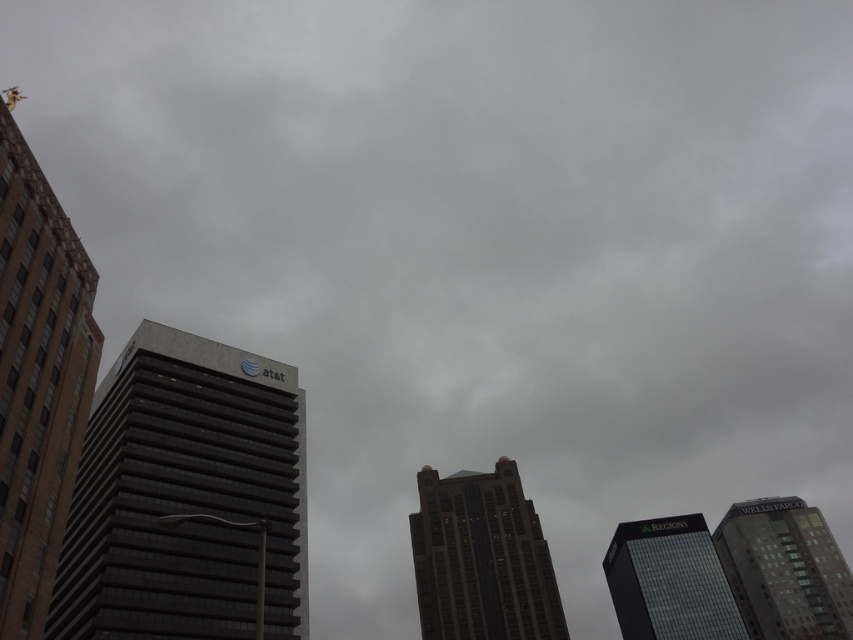
You are standing in the city and want to take a photo of the gray glass building at center. If your camera can focus on objects up to 25 meters away, will you be able to capture a clear image?

The gray glass building at center is 22.74 meters from viewer, so yes, the camera can focus on it clearly since it is within the 25 meters range.

You are a photographer standing in the city square, aiming to capture a photo of the gray glass building at center and the glassy black skyscraper at lower right. Which building should you focus on first if you want to ensure both are in sharp focus?

The gray glass building at center is closer to the viewer than the glassy black skyscraper at lower right. To ensure both are in sharp focus, you should focus on the gray glass building at center first, as it is closer, and adjust the depth of field accordingly.

You are a drone operator who needs to deliver a package to the brown glass skyscraper at left. Your drone is currently hovering at point (38,378). Can you confirm if you are directly above the building?

Yes, you are directly above the brown glass skyscraper at left because the point (38,378) is where it is located.